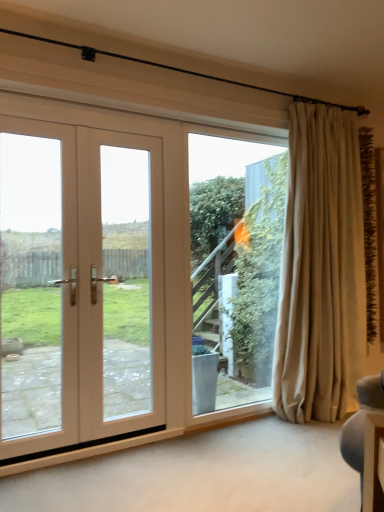
Question: From a real-world perspective, is white wood door at left beneath transparent glass window at center?

Choices:
 (A) yes
 (B) no

Answer: (B)

Question: Is white wood door at left positioned before transparent glass window at center?

Choices:
 (A) yes
 (B) no

Answer: (A)

Question: From the image's perspective, does white wood door at left appear lower than transparent glass window at center?

Choices:
 (A) no
 (B) yes

Answer: (A)

Question: Can transparent glass window at center be found inside white wood door at left?

Choices:
 (A) no
 (B) yes

Answer: (A)

Question: Could you tell me if white wood door at left is turned towards transparent glass window at center?

Choices:
 (A) no
 (B) yes

Answer: (A)

Question: Can you confirm if white wood door at left is smaller than transparent glass window at center?

Choices:
 (A) yes
 (B) no

Answer: (B)

Question: Is beige fabric curtain at right shorter than white wood door at left?

Choices:
 (A) yes
 (B) no

Answer: (B)

Question: Is beige fabric curtain at right at the right side of white wood door at left?

Choices:
 (A) yes
 (B) no

Answer: (A)

Question: Is beige fabric curtain at right completely or partially outside of white wood door at left?

Choices:
 (A) no
 (B) yes

Answer: (B)

Question: Can you confirm if beige fabric curtain at right is taller than white wood door at left?

Choices:
 (A) yes
 (B) no

Answer: (A)

Question: Is beige fabric curtain at right surrounding white wood door at left?

Choices:
 (A) yes
 (B) no

Answer: (B)

Question: Would you say beige fabric curtain at right is a long distance from white wood door at left?

Choices:
 (A) no
 (B) yes

Answer: (A)

Question: Does beige fabric curtain at right have a lesser width compared to transparent glass window at center?

Choices:
 (A) no
 (B) yes

Answer: (A)